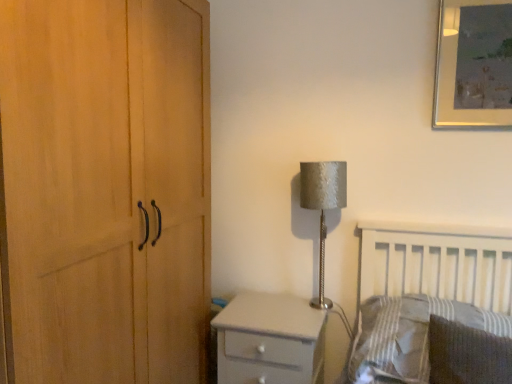
The height and width of the screenshot is (384, 512). Identify the location of silver textured lampshade at upper right. (323, 205).

How much space does striped fabric pillow at lower right, the second pillow in the front-to-back sequence, occupy vertically?

It is 9.67 inches.

Find the location of a particular element. silver textured lampshade at upper right is located at coordinates (323, 205).

Find the location of a particular element. The image size is (512, 384). picture frame that is behind the striped fabric pillow at lower right, the second pillow in the front-to-back sequence is located at coordinates point(473,65).

Is metallic silver picture frame at upper right positioned with its back to striped fabric pillow at lower right, the second pillow in the front-to-back sequence?

No, striped fabric pillow at lower right, the second pillow in the front-to-back sequence, is not at the back of metallic silver picture frame at upper right.

Between metallic silver picture frame at upper right and striped fabric pillow at lower right, the first pillow viewed from the back, which one is positioned in front?

striped fabric pillow at lower right, the first pillow viewed from the back, is closer to the camera.

Is metallic silver picture frame at upper right touching striped fabric pillow at lower right, the second pillow in the front-to-back sequence?

metallic silver picture frame at upper right and striped fabric pillow at lower right, the second pillow in the front-to-back sequence, are not in contact.

Which object is closer to the camera taking this photo, dark gray textured pillow at lower right, the 1th pillow in the front-to-back sequence, or metallic silver picture frame at upper right?

dark gray textured pillow at lower right, the 1th pillow in the front-to-back sequence, is in front.

Identify the location of the 2nd pillow positioned below the metallic silver picture frame at upper right (from the image's perspective). (467, 354).

Which is correct: dark gray textured pillow at lower right, the 1th pillow in the front-to-back sequence, is inside metallic silver picture frame at upper right, or outside of it?

dark gray textured pillow at lower right, the 1th pillow in the front-to-back sequence, is not enclosed by metallic silver picture frame at upper right.

Is dark gray textured pillow at lower right, the 1th pillow in the front-to-back sequence, shorter than metallic silver picture frame at upper right?

Correct, dark gray textured pillow at lower right, the 1th pillow in the front-to-back sequence, is not as tall as metallic silver picture frame at upper right.

From a real-world perspective, is white glossy chest of drawers at lower center positioned above or below dark gray textured pillow at lower right, the 1th pillow in the front-to-back sequence?

white glossy chest of drawers at lower center is situated lower than dark gray textured pillow at lower right, the 1th pillow in the front-to-back sequence, in the real world.

In the scene shown: Is white glossy chest of drawers at lower center not close to dark gray textured pillow at lower right, the 1th pillow in the front-to-back sequence?

No, white glossy chest of drawers at lower center is in close proximity to dark gray textured pillow at lower right, the 1th pillow in the front-to-back sequence.

Between white glossy chest of drawers at lower center and dark gray textured pillow at lower right, the 1th pillow in the front-to-back sequence, which one is positioned in front?

Positioned in front is dark gray textured pillow at lower right, the 1th pillow in the front-to-back sequence.

Based on the photo, between dark gray textured pillow at lower right, the 2th pillow from the back, and silver textured lampshade at upper right, which one has larger size?

Bigger between the two is dark gray textured pillow at lower right, the 2th pillow from the back.

Is dark gray textured pillow at lower right, the 1th pillow in the front-to-back sequence, located outside silver textured lampshade at upper right?

Indeed, dark gray textured pillow at lower right, the 1th pillow in the front-to-back sequence, is completely outside silver textured lampshade at upper right.

Is dark gray textured pillow at lower right, the 2th pillow from the back, positioned before silver textured lampshade at upper right?

Yes, dark gray textured pillow at lower right, the 2th pillow from the back, is closer to the viewer.

Between dark gray textured pillow at lower right, the 2th pillow from the back, and silver textured lampshade at upper right, which one has larger width?

Answer: With larger width is dark gray textured pillow at lower right, the 2th pillow from the back.

The image size is (512, 384). What are the coordinates of `picture frame lying in front of the silver textured lampshade at upper right` in the screenshot? It's located at (473, 65).

Could you measure the distance between metallic silver picture frame at upper right and silver textured lampshade at upper right?

metallic silver picture frame at upper right and silver textured lampshade at upper right are 24.08 inches apart from each other.

Are metallic silver picture frame at upper right and silver textured lampshade at upper right making contact?

No, metallic silver picture frame at upper right is not touching silver textured lampshade at upper right.

From the image's perspective, does metallic silver picture frame at upper right appear lower than silver textured lampshade at upper right?

No, from the image's perspective, metallic silver picture frame at upper right is not beneath silver textured lampshade at upper right.

In the scene shown: Which is correct: silver textured lampshade at upper right is inside striped fabric pillow at lower right, the first pillow viewed from the back, or outside of it?

silver textured lampshade at upper right is outside striped fabric pillow at lower right, the first pillow viewed from the back.

From a real-world perspective, is silver textured lampshade at upper right positioned over striped fabric pillow at lower right, the first pillow viewed from the back, based on gravity?

Yes, from a real-world perspective, silver textured lampshade at upper right is over striped fabric pillow at lower right, the first pillow viewed from the back

Where is `the 1st pillow located beneath the silver textured lampshade at upper right (from a real-world perspective)`? the 1st pillow located beneath the silver textured lampshade at upper right (from a real-world perspective) is located at coordinates (408, 336).

From a real-world perspective, which object stands above the other?

dark gray textured pillow at lower right, the 1th pillow in the front-to-back sequence, from a real-world perspective.

Can you confirm if dark gray textured pillow at lower right, the 1th pillow in the front-to-back sequence, is shorter than white glossy chest of drawers at lower center?

Yes, dark gray textured pillow at lower right, the 1th pillow in the front-to-back sequence, is shorter than white glossy chest of drawers at lower center.

Can you tell me how much dark gray textured pillow at lower right, the 1th pillow in the front-to-back sequence, and white glossy chest of drawers at lower center differ in facing direction?

The angular difference between dark gray textured pillow at lower right, the 1th pillow in the front-to-back sequence, and white glossy chest of drawers at lower center is 8.23 degrees.

Measure the distance between dark gray textured pillow at lower right, the 2th pillow from the back, and white glossy chest of drawers at lower center.

A distance of 54.46 centimeters exists between dark gray textured pillow at lower right, the 2th pillow from the back, and white glossy chest of drawers at lower center.

In order to click on the 1st pillow in front of the metallic silver picture frame at upper right in this screenshot , I will do `click(408, 336)`.

Where is `picture frame lying behind the dark gray textured pillow at lower right, the 2th pillow from the back`? The height and width of the screenshot is (384, 512). picture frame lying behind the dark gray textured pillow at lower right, the 2th pillow from the back is located at coordinates (473, 65).

Based on their spatial positions, is silver textured lampshade at upper right or striped fabric pillow at lower right, the second pillow in the front-to-back sequence, closer to dark gray textured pillow at lower right, the 1th pillow in the front-to-back sequence?

striped fabric pillow at lower right, the second pillow in the front-to-back sequence, lies closer to dark gray textured pillow at lower right, the 1th pillow in the front-to-back sequence, than the other object.

Estimate the real-world distances between objects in this image. Which object is further from dark gray textured pillow at lower right, the 2th pillow from the back, striped fabric pillow at lower right, the first pillow viewed from the back, or white glossy chest of drawers at lower center?

white glossy chest of drawers at lower center is further to dark gray textured pillow at lower right, the 2th pillow from the back.

From the image, which object appears to be nearer to dark gray textured pillow at lower right, the 2th pillow from the back, white glossy chest of drawers at lower center or silver textured lampshade at upper right?

The object closer to dark gray textured pillow at lower right, the 2th pillow from the back, is white glossy chest of drawers at lower center.

Based on the photo, which object lies nearer to the anchor point striped fabric pillow at lower right, the first pillow viewed from the back, white glossy chest of drawers at lower center or dark gray textured pillow at lower right, the 1th pillow in the front-to-back sequence?

The object closer to striped fabric pillow at lower right, the first pillow viewed from the back, is dark gray textured pillow at lower right, the 1th pillow in the front-to-back sequence.

Which object lies further to the anchor point metallic silver picture frame at upper right, dark gray textured pillow at lower right, the 1th pillow in the front-to-back sequence, or white glossy chest of drawers at lower center?

white glossy chest of drawers at lower center is positioned further to the anchor metallic silver picture frame at upper right.

Considering their positions, is white glossy chest of drawers at lower center positioned further to striped fabric pillow at lower right, the first pillow viewed from the back, than silver textured lampshade at upper right?

silver textured lampshade at upper right lies further to striped fabric pillow at lower right, the first pillow viewed from the back, than the other object.

Which object lies nearer to the anchor point white glossy chest of drawers at lower center, silver textured lampshade at upper right or metallic silver picture frame at upper right?

silver textured lampshade at upper right lies closer to white glossy chest of drawers at lower center than the other object.

Which object lies nearer to the anchor point metallic silver picture frame at upper right, dark gray textured pillow at lower right, the 2th pillow from the back, or silver textured lampshade at upper right?

Among the two, silver textured lampshade at upper right is located nearer to metallic silver picture frame at upper right.

I want to click on pillow between metallic silver picture frame at upper right and dark gray textured pillow at lower right, the 2th pillow from the back, in the up-down direction, so click(408, 336).

This screenshot has height=384, width=512. What are the coordinates of `table lamp between metallic silver picture frame at upper right and white glossy chest of drawers at lower center in the up-down direction` in the screenshot? It's located at (323, 205).

In order to click on table lamp that lies between metallic silver picture frame at upper right and dark gray textured pillow at lower right, the 1th pillow in the front-to-back sequence, from top to bottom in this screenshot , I will do `click(323, 205)`.

Where is `pillow located between dark gray textured pillow at lower right, the 1th pillow in the front-to-back sequence, and silver textured lampshade at upper right in the depth direction`? Image resolution: width=512 pixels, height=384 pixels. pillow located between dark gray textured pillow at lower right, the 1th pillow in the front-to-back sequence, and silver textured lampshade at upper right in the depth direction is located at coordinates (408, 336).